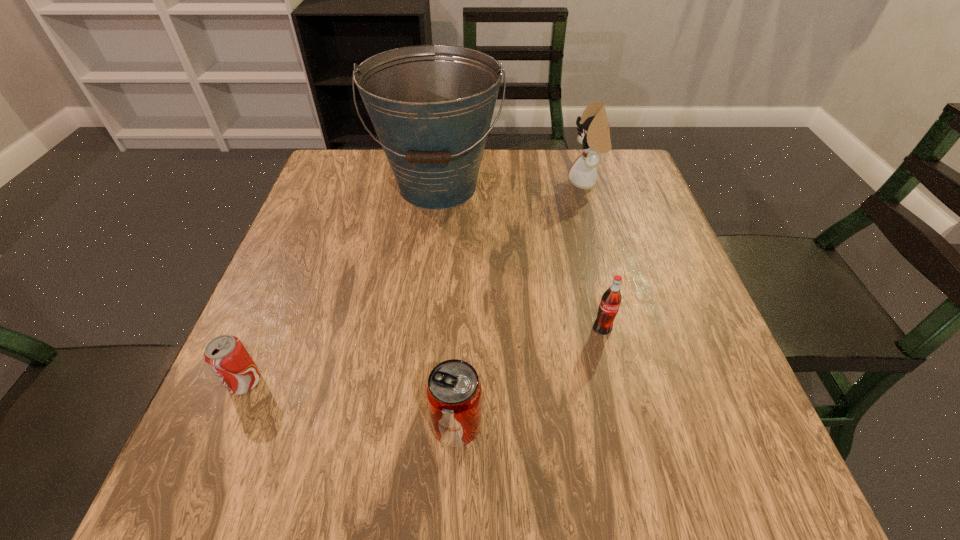
The image size is (960, 540). In order to click on object that is at the right edge in this screenshot , I will do `click(595, 134)`.

Image resolution: width=960 pixels, height=540 pixels. Find the location of `object present at the far left corner`. object present at the far left corner is located at coordinates (431, 106).

The image size is (960, 540). What are the coordinates of `object located in the far right corner section of the desktop` in the screenshot? It's located at (595, 134).

In the image, there is a desktop. At what (x,y) coordinates should I click in order to perform the action: click on free region at the far edge. Please return your answer as a coordinate pair (x, y). Looking at the image, I should click on (388, 166).

At what (x,y) coordinates should I click in order to perform the action: click on vacant area at the near edge of the desktop. Please return your answer as a coordinate pair (x, y). Looking at the image, I should click on (401, 487).

This screenshot has width=960, height=540. Identify the location of blank space at the left edge. (333, 313).

Where is `vacant space at the right edge of the desktop`? The image size is (960, 540). vacant space at the right edge of the desktop is located at coordinates (693, 345).

Image resolution: width=960 pixels, height=540 pixels. I want to click on vacant space at the far left corner of the desktop, so click(342, 173).

You are a GUI agent. You are given a task and a screenshot of the screen. Output one action in this format:
    pyautogui.click(x=<x>, y=<y>)
    Task: Click on the vacant area at the far right corner of the desktop
    
    Given the screenshot: What is the action you would take?
    pyautogui.click(x=615, y=160)

This screenshot has width=960, height=540. Identify the location of vacant area between the shortest soda can and the second tallest object. (416, 282).